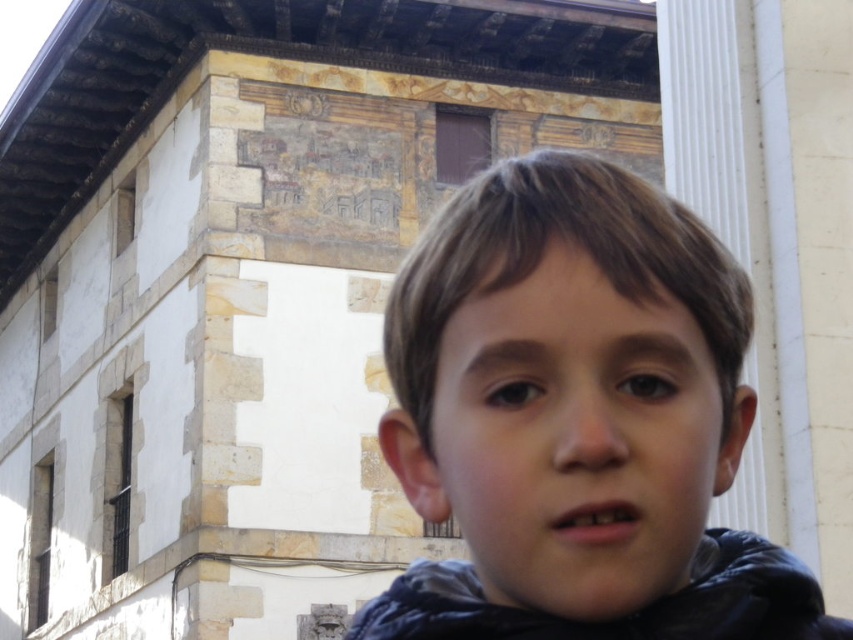
Who is shorter, dark blue fleece at center or dark blue fleece jacket at lower right?

dark blue fleece jacket at lower right

Is point (769, 596) closer to camera compared to point (430, 604)?

Yes, point (769, 596) is in front of point (430, 604).

This screenshot has width=853, height=640. In order to click on dark blue fleece at center in this screenshot , I will do `click(577, 419)`.